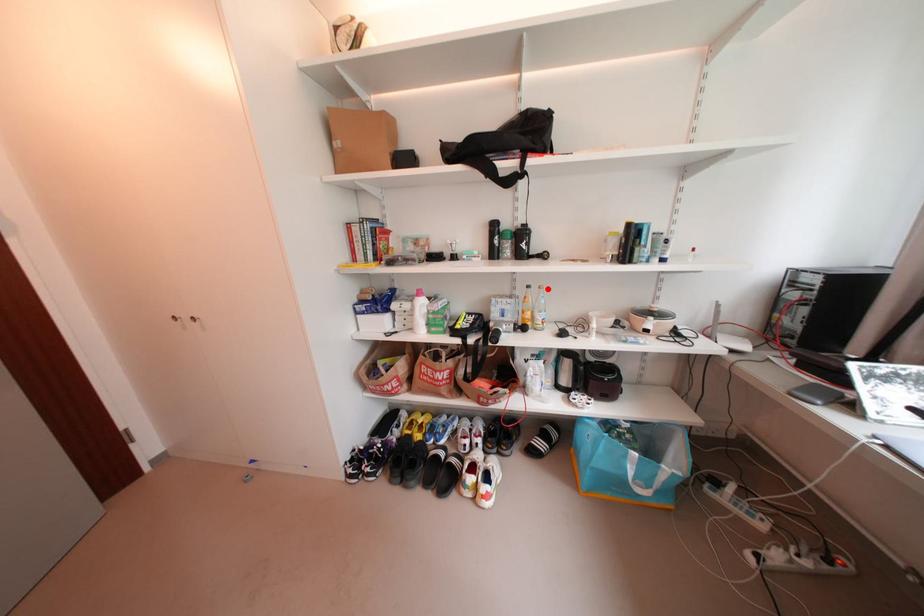
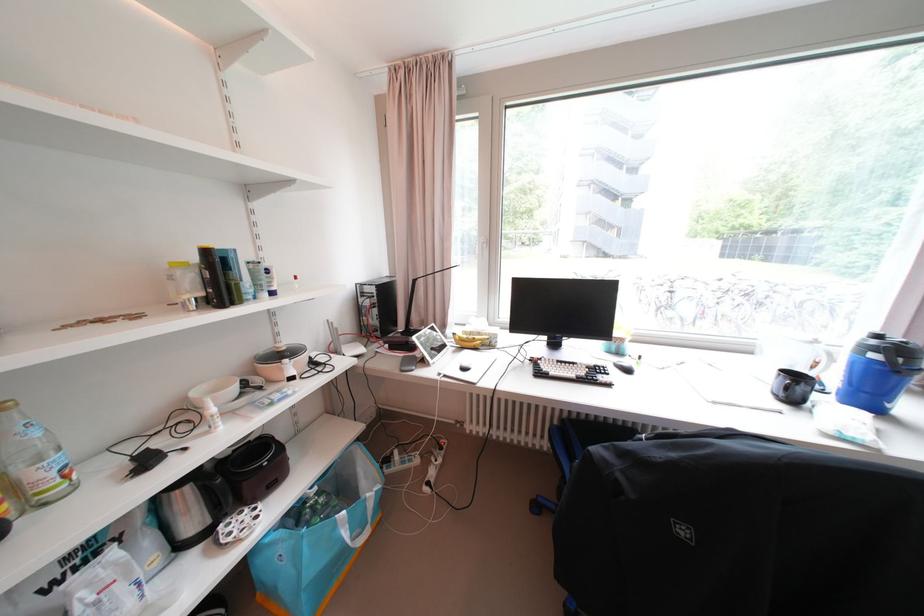
The point at the highlighted location is marked in the first image. Where is the corresponding point in the second image?

(6, 410)